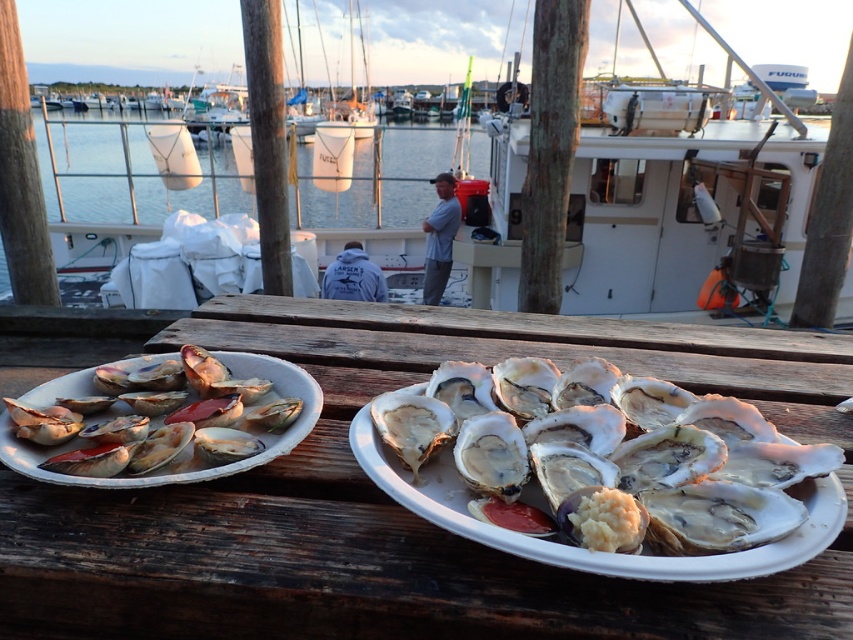
You are a chef preparing a seafood platter and need to place the shiny white oyster at center on the wooden table at center. Based on the scene, will the oyster be visible from the water below the deck?

The wooden table at center is in front of the shiny white oyster at center, so placing the oyster on the table would position it closer to the viewer and likely visible from the water below the deck.

You are a guest at a waterfront dinner and need to place your napkin. The wooden table at center and the shiny red shell at left are both available. Which surface has enough space for your napkin?

The wooden table at center has a larger size compared to the shiny red shell at left, so the wooden table at center has enough space for your napkin.

Based on the photo, you are standing at the edge of the wooden deck and want to place a new plate of mussels between the two existing plates on the wooden table at center. Based on the current arrangement of the opened clams and oysters, where should you place the new plate?

The wooden table at center is located at point (x=381, y=492), so place the new plate of mussels between the existing plates of opened clams and oysters on the wooden table at center.